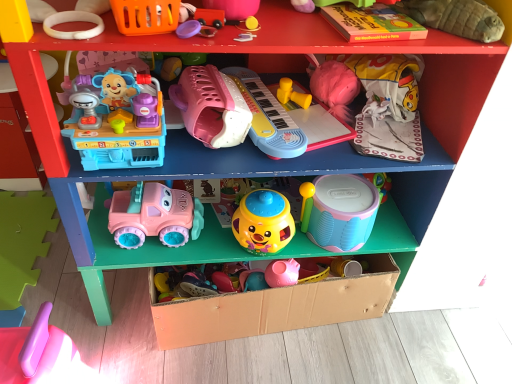
Question: Is yellow plastic toy at upper center, placed as the ninth toy when sorted from left to right, at the back of soft plush turtle at upper right, the twelfth toy positioned from the left?

Choices:
 (A) yes
 (B) no

Answer: (B)

Question: From the image's perspective, is soft plush turtle at upper right, marked as the 1th toy in a right-to-left arrangement, located above yellow plastic toy at upper center, placed as the ninth toy when sorted from left to right?

Choices:
 (A) no
 (B) yes

Answer: (B)

Question: Is there a large distance between soft plush turtle at upper right, marked as the 1th toy in a right-to-left arrangement, and yellow plastic toy at upper center, marked as the 4th toy in a right-to-left arrangement?

Choices:
 (A) no
 (B) yes

Answer: (A)

Question: Considering the relative positions of soft plush turtle at upper right, marked as the 1th toy in a right-to-left arrangement, and yellow plastic toy at upper center, marked as the 4th toy in a right-to-left arrangement, in the image provided, is soft plush turtle at upper right, marked as the 1th toy in a right-to-left arrangement, to the right of yellow plastic toy at upper center, marked as the 4th toy in a right-to-left arrangement, from the viewer's perspective?

Choices:
 (A) yes
 (B) no

Answer: (A)

Question: Does soft plush turtle at upper right, marked as the 1th toy in a right-to-left arrangement, have a lesser height compared to yellow plastic toy at upper center, marked as the 4th toy in a right-to-left arrangement?

Choices:
 (A) no
 (B) yes

Answer: (A)

Question: Considering their positions, is pink plastic spatula at lower left, the 12th toy when ordered from right to left, located in front of or behind yellow rubber ball at upper center, which is the 7th toy in right-to-left order?

Choices:
 (A) front
 (B) behind

Answer: (A)

Question: Based on their positions, is pink plastic spatula at lower left, the 12th toy when ordered from right to left, located to the left or right of yellow rubber ball at upper center, which is the 7th toy in right-to-left order?

Choices:
 (A) right
 (B) left

Answer: (B)

Question: Is point (31, 377) positioned closer to the camera than point (241, 23)?

Choices:
 (A) farther
 (B) closer

Answer: (A)

Question: From the image's perspective, is pink plastic spatula at lower left, marked as the first toy in a left-to-right arrangement, located above or below yellow rubber ball at upper center, which is the sixth toy in left-to-right order?

Choices:
 (A) above
 (B) below

Answer: (B)

Question: From their relative heights in the image, would you say yellow matte plastic cup at center, which is the 8th toy in left-to-right order, is taller or shorter than matte pink plastic truck at lower center, positioned as the second toy in left-to-right order?

Choices:
 (A) tall
 (B) short

Answer: (A)

Question: From the image's perspective, is yellow matte plastic cup at center, which is the 8th toy in left-to-right order, above or below matte pink plastic truck at lower center, positioned as the second toy in left-to-right order?

Choices:
 (A) above
 (B) below

Answer: (B)

Question: Visually, is yellow matte plastic cup at center, which is the 8th toy in left-to-right order, positioned to the left or to the right of matte pink plastic truck at lower center, the 11th toy in the right-to-left sequence?

Choices:
 (A) left
 (B) right

Answer: (B)

Question: Is yellow matte plastic cup at center, placed as the fifth toy when sorted from right to left, in front of or behind matte pink plastic truck at lower center, the 11th toy in the right-to-left sequence, in the image?

Choices:
 (A) front
 (B) behind

Answer: (A)

Question: In terms of size, does rubber duck at upper center, arranged as the 3th toy when viewed from the right, appear bigger or smaller than purple plastic lid at upper center, which is the ninth toy in right-to-left order?

Choices:
 (A) small
 (B) big

Answer: (B)

Question: Considering the positions of point (309, 3) and point (197, 31), is point (309, 3) closer or farther from the camera than point (197, 31)?

Choices:
 (A) closer
 (B) farther

Answer: (B)